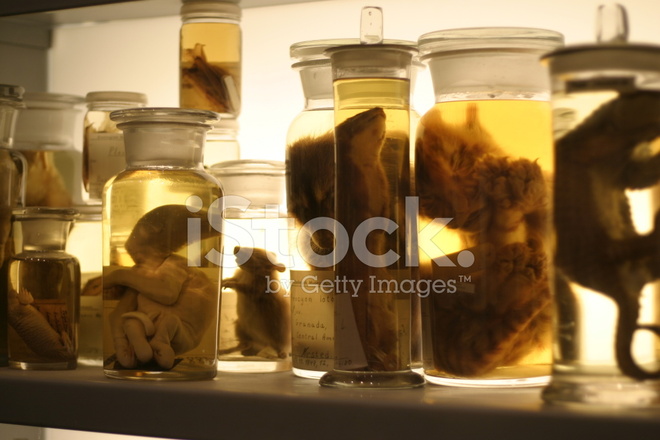
What are the coordinates of `glass` in the screenshot? It's located at (530, 101).